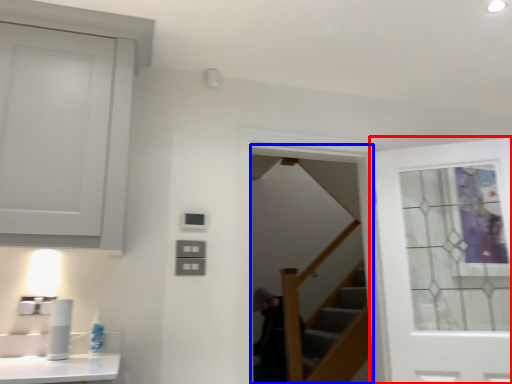
Question: Which of the following is the farthest to the observer, door (highlighted by a red box) or screen door (highlighted by a blue box)?

Choices:
 (A) door
 (B) screen door

Answer: (B)